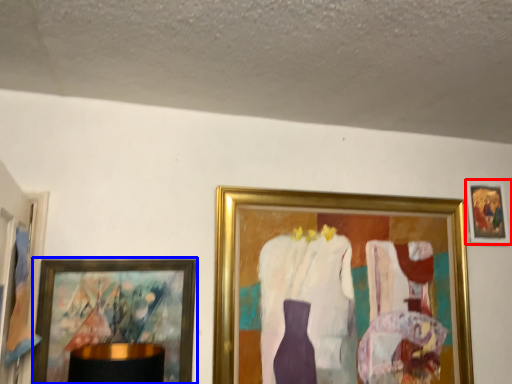
Question: Which of the following is the closest to the observer, picture frame (highlighted by a red box) or picture frame (highlighted by a blue box)?

Choices:
 (A) picture frame
 (B) picture frame

Answer: (B)